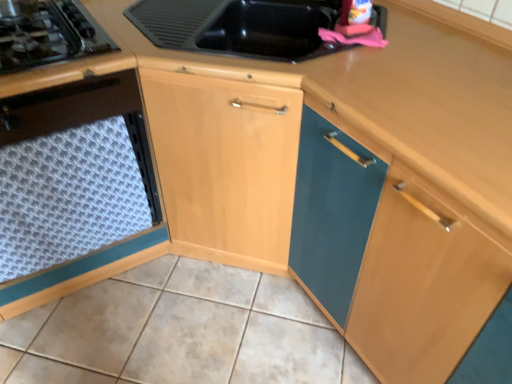
In order to face wooden at upper right, should I rotate leftwards or rightwards?

Turn right approximately 24.509 degrees to face it.

What do you see at coordinates (183, 331) in the screenshot?
I see `white textured tile at lower center` at bounding box center [183, 331].

You are a GUI agent. You are given a task and a screenshot of the screen. Output one action in this format:
    pyautogui.click(x=<x>, y=<y>)
    Task: Click on the white textured tile at lower center
    The image size is (512, 384).
    Given the screenshot: What is the action you would take?
    pyautogui.click(x=183, y=331)

You are a GUI agent. You are given a task and a screenshot of the screen. Output one action in this format:
    pyautogui.click(x=<x>, y=<y>)
    Task: Click on the wooden at upper right
    
    Given the screenshot: What is the action you would take?
    point(432,100)

At what (x,y) coordinates should I click in order to perform the action: click on cabinetry that appears above the wooden at upper right (from the image's perspective). Please return your answer as a coordinate pair (x, y). Looking at the image, I should click on (85, 189).

Is white textured mat at lower left facing away from wooden at upper right?

No, white textured mat at lower left is not facing the opposite direction of wooden at upper right.

Is wooden at upper right surrounded by white textured mat at lower left?

Definitely not — wooden at upper right is not inside white textured mat at lower left.

Relative to wooden at upper right, is white textured mat at lower left in front or behind?

In the image, white textured mat at lower left appears behind wooden at upper right.

Is wooden at upper right oriented towards white textured tile at lower center?

Yes, wooden at upper right is oriented towards white textured tile at lower center.

Which object is closer to the camera, wooden at upper right or white textured tile at lower center?

wooden at upper right is in front.

Which of these two, wooden at upper right or white textured tile at lower center, is wider?

white textured tile at lower center is wider.

Is wooden at upper right not inside white textured tile at lower center?

Yes, wooden at upper right is located beyond the bounds of white textured tile at lower center.

Which of these two, white textured tile at lower center or white textured mat at lower left, stands shorter?

With less height is white textured tile at lower center.

Which is farther, [329,368] or [7,315]?

The point [7,315] is farther from the camera.

Based on the photo, would you say white textured tile at lower center contains white textured mat at lower left?

No, white textured mat at lower left is located outside of white textured tile at lower center.

Is white textured tile at lower center in front of or behind white textured mat at lower left in the image?

Visually, white textured tile at lower center is located behind white textured mat at lower left.

From a real-world perspective, who is located higher, black glass gas stove at left or wooden at upper right?

black glass gas stove at left.

Between point (32, 21) and point (325, 97), which one is positioned behind?

Positioned behind is point (32, 21).

From the picture: Which of these two, black glass gas stove at left or wooden at upper right, is wider?

Wider between the two is wooden at upper right.

Could you tell me if black glass gas stove at left is turned towards wooden at upper right?

No, black glass gas stove at left is not turned towards wooden at upper right.

Which object is positioned more to the left, wooden at upper right or black glass gas stove at left?

black glass gas stove at left.

From a real-world perspective, is wooden at upper right positioned over black glass gas stove at left based on gravity?

Actually, wooden at upper right is physically below black glass gas stove at left in the real world.

Locate an element on the screen. gas stove located above the wooden at upper right (from the image's perspective) is located at coordinates (47, 33).

Are wooden at upper right and black glass gas stove at left beside each other?

No, wooden at upper right is not next to black glass gas stove at left.

Can you tell me how much black glass gas stove at left and white textured mat at lower left differ in facing direction?

black glass gas stove at left and white textured mat at lower left are facing 0.000653 degrees away from each other.

Is black glass gas stove at left facing towards white textured mat at lower left?

Yes, black glass gas stove at left is turned towards white textured mat at lower left.

This screenshot has height=384, width=512. In order to click on gas stove located above the white textured mat at lower left (from the image's perspective) in this screenshot , I will do `click(47, 33)`.

Which is more to the right, black glass gas stove at left or white textured mat at lower left?

black glass gas stove at left.

From the image's perspective, between white textured mat at lower left and black glass gas stove at left, which one is located above?

black glass gas stove at left is shown above in the image.

Who is smaller, white textured mat at lower left or black glass gas stove at left?

black glass gas stove at left.

Is point (16, 314) positioned in front of point (67, 44)?

No, it is behind (67, 44).

Is white textured mat at lower left not within black glass gas stove at left?

Yes, white textured mat at lower left is not within black glass gas stove at left.

This screenshot has width=512, height=384. I want to click on cabinetry on the left side of wooden at upper right, so click(x=85, y=189).

At what (x,y) coordinates should I click in order to perform the action: click on counter top on the right of the white textured tile at lower center. Please return your answer as a coordinate pair (x, y). This screenshot has width=512, height=384. Looking at the image, I should click on (432, 100).

Looking at the image, which one is located closer to white textured mat at lower left, black glass gas stove at left or wooden at upper right?

Based on the image, black glass gas stove at left appears to be nearer to white textured mat at lower left.

Considering their positions, is black glass gas stove at left positioned further to wooden at upper right than white textured tile at lower center?

white textured tile at lower center.

Estimate the real-world distances between objects in this image. Which object is further from wooden at upper right, white textured mat at lower left or black glass gas stove at left?

black glass gas stove at left is positioned further to the anchor wooden at upper right.

Consider the image. Looking at the image, which one is located further to white textured tile at lower center, wooden at upper right or white textured mat at lower left?

The object further to white textured tile at lower center is wooden at upper right.

From the image, which object appears to be nearer to wooden at upper right, white textured mat at lower left or white textured tile at lower center?

white textured mat at lower left lies closer to wooden at upper right than the other object.

From the image, which object appears to be nearer to white textured tile at lower center, black glass gas stove at left or wooden at upper right?

black glass gas stove at left.

Estimate the real-world distances between objects in this image. Which object is further from black glass gas stove at left, white textured tile at lower center or white textured mat at lower left?

white textured tile at lower center is further to black glass gas stove at left.

When comparing their distances from wooden at upper right, does white textured tile at lower center or black glass gas stove at left seem closer?

black glass gas stove at left lies closer to wooden at upper right than the other object.

Where is `cabinetry between black glass gas stove at left and white textured tile at lower center vertically`? This screenshot has width=512, height=384. cabinetry between black glass gas stove at left and white textured tile at lower center vertically is located at coordinates (85, 189).

At what (x,y) coordinates should I click in order to perform the action: click on tile located between black glass gas stove at left and wooden at upper right in the left-right direction. Please return your answer as a coordinate pair (x, y). Image resolution: width=512 pixels, height=384 pixels. Looking at the image, I should click on (183, 331).

The image size is (512, 384). I want to click on gas stove situated between white textured mat at lower left and wooden at upper right from left to right, so pyautogui.click(x=47, y=33).

Find the location of a particular element. tile located between white textured mat at lower left and wooden at upper right in the left-right direction is located at coordinates (183, 331).